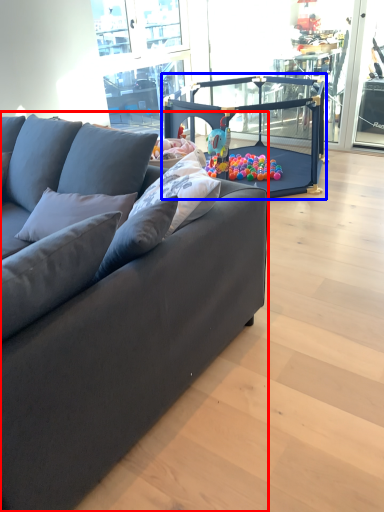
Question: Which of the following is the farthest to the observer, studio couch (highlighted by a red box) or baby carriage (highlighted by a blue box)?

Choices:
 (A) studio couch
 (B) baby carriage

Answer: (B)